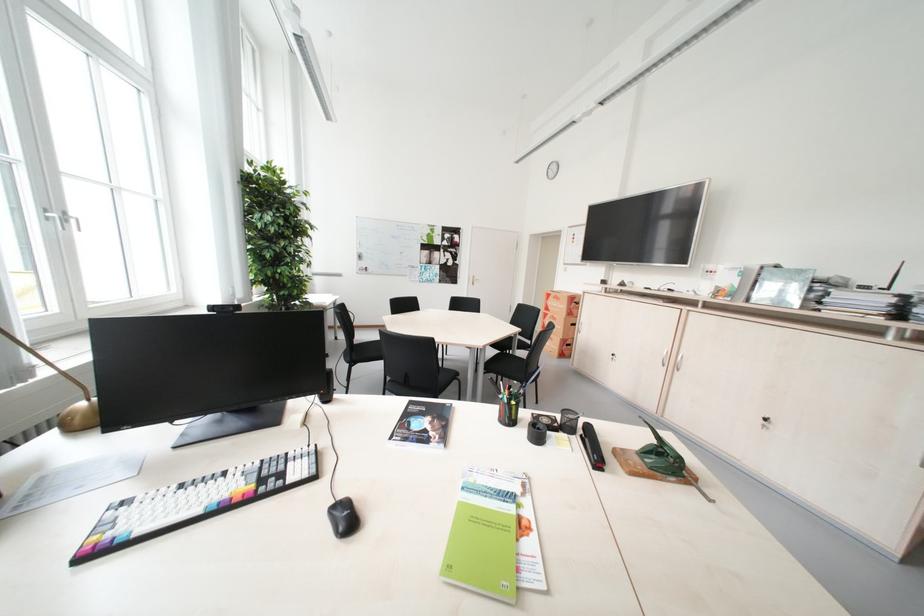
Locate an element on the screen. This screenshot has height=616, width=924. cardboard box is located at coordinates (558, 300).